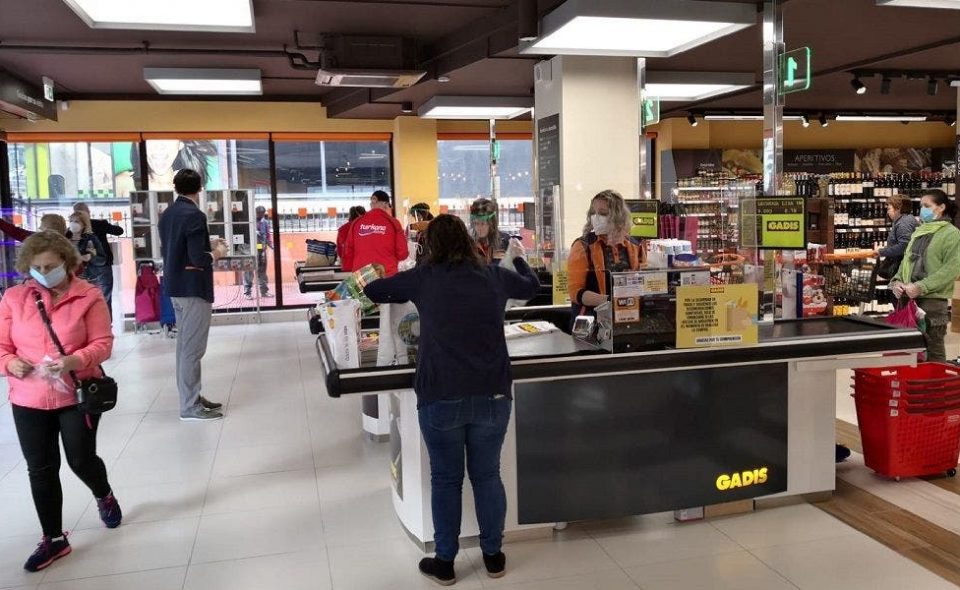
Locate an element on the screen. This screenshot has width=960, height=590. group of red baskets is located at coordinates (908, 415).